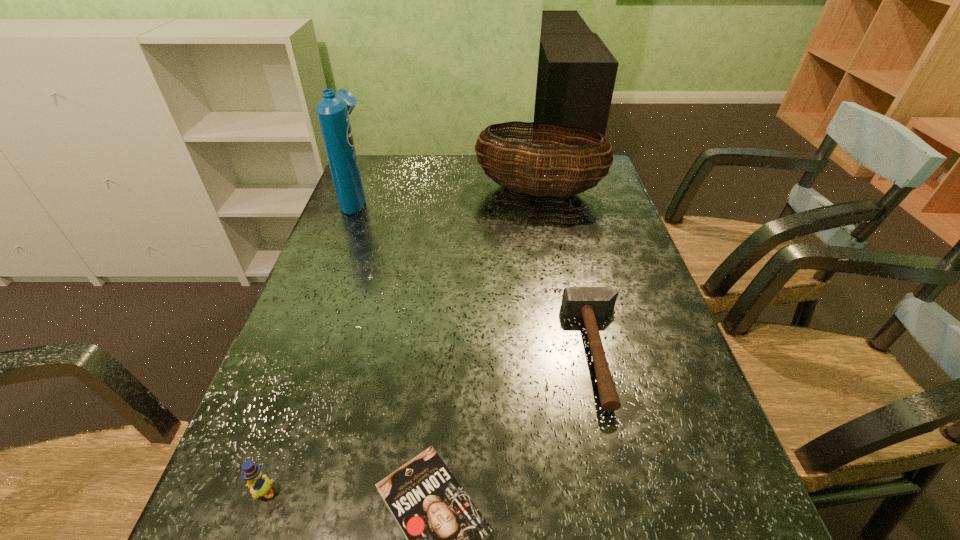
You are a GUI agent. You are given a task and a screenshot of the screen. Output one action in this format:
    pyautogui.click(x=<x>, y=<y>)
    Task: Click on the free point at the right edge
    This screenshot has width=960, height=540.
    Given the screenshot: What is the action you would take?
    pyautogui.click(x=641, y=357)

The image size is (960, 540). I want to click on free region at the far left corner of the desktop, so click(362, 164).

The image size is (960, 540). What are the coordinates of `free space between the second tallest object and the second shortest object` in the screenshot? It's located at (569, 271).

The height and width of the screenshot is (540, 960). Find the location of `free space that is in between the third shortest object and the shampoo`. free space that is in between the third shortest object and the shampoo is located at coordinates (310, 345).

Locate an element on the screen. unoccupied area between the shampoo and the hammer is located at coordinates pyautogui.click(x=477, y=274).

Image resolution: width=960 pixels, height=540 pixels. What are the coordinates of `free spot between the duckling and the fourth shortest object` in the screenshot? It's located at (401, 341).

Find the location of a particular element. vacant space that is in between the shampoo and the basket is located at coordinates (447, 194).

Locate an element on the screen. This screenshot has height=540, width=960. free area in between the tallest object and the duckling is located at coordinates (310, 345).

This screenshot has width=960, height=540. I want to click on the closest object to the shampoo, so click(499, 157).

At what (x,y) coordinates should I click in order to perform the action: click on object that is the fourth closest to the basket. Please return your answer as a coordinate pair (x, y). This screenshot has height=540, width=960. Looking at the image, I should click on (259, 485).